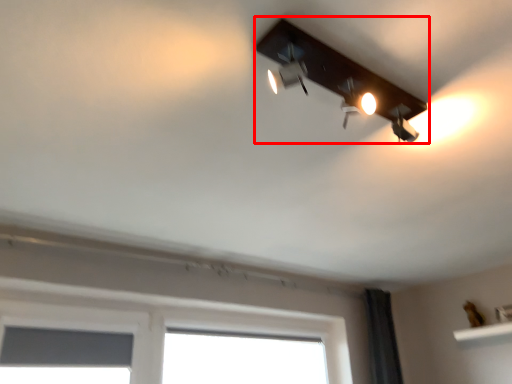
Question: Observing the image, what is the correct spatial positioning of lamp (annotated by the red box) in reference to window screen?

Choices:
 (A) right
 (B) left

Answer: (A)